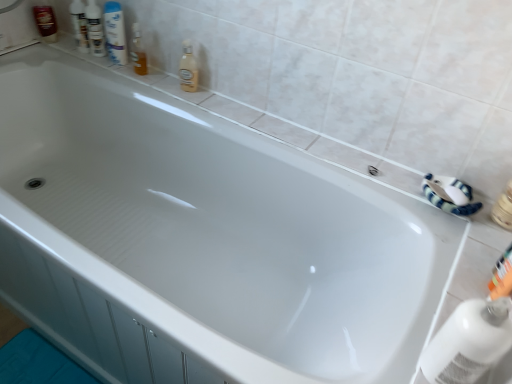
This screenshot has width=512, height=384. In order to click on vacant location behind transparent plastic bottle at lower right, marked as the 2th cleaning product in a back-to-front arrangement in this screenshot , I will do click(442, 295).